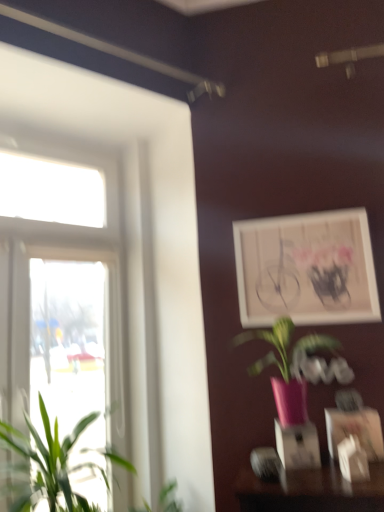
Question: Considering the relative positions of matte white picture frame at lower right, arranged as the first picture frame when viewed from the front, and white matte picture frame at upper right, the second picture frame positioned from the bottom, in the image provided, is matte white picture frame at lower right, arranged as the first picture frame when viewed from the front, to the left or to the right of white matte picture frame at upper right, the second picture frame positioned from the bottom,?

Choices:
 (A) right
 (B) left

Answer: (A)

Question: Is matte white picture frame at lower right, arranged as the first picture frame when viewed from the front, taller or shorter than white matte picture frame at upper right, the second picture frame positioned from the bottom?

Choices:
 (A) short
 (B) tall

Answer: (A)

Question: Estimate the real-world distances between objects in this image. Which object is closer to the matte white picture frame at lower right, arranged as the first picture frame when viewed from the front?

Choices:
 (A) white matte picture frame at upper right, which is the 2th picture frame in front-to-back order
 (B) pink matte vase at center, the first houseplant in the right-to-left sequence
 (C) green leafy plant at left, the 2th houseplant in the right-to-left sequence
 (D) clear glass window at left

Answer: (B)

Question: Which is nearer to the pink matte vase at center, marked as the 2th houseplant in a left-to-right arrangement?

Choices:
 (A) white matte picture frame at upper right, which is the 2th picture frame in front-to-back order
 (B) green leafy plant at left, the 1th houseplant viewed from the left
 (C) matte white picture frame at lower right, marked as the second picture frame in a top-to-bottom arrangement
 (D) clear glass window at left

Answer: (C)